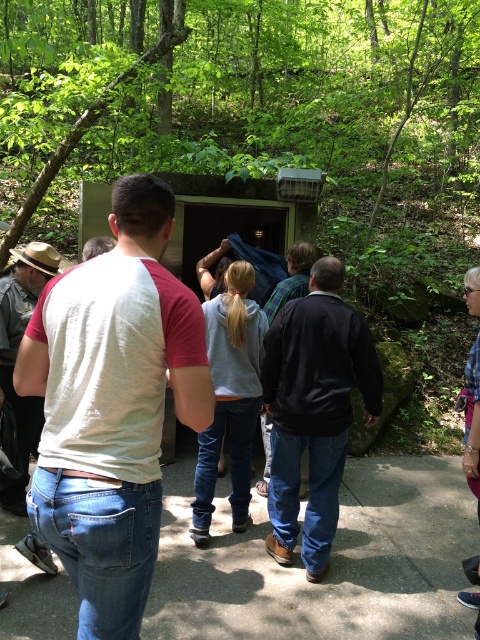
Question: Which of the following is the farthest from the observer?

Choices:
 (A) black leather jacket at center
 (B) white/red raglan shirt at center
 (C) dark blue flannel shirt at center
 (D) matte brown hat at left

Answer: (C)

Question: Can you confirm if white/red raglan shirt at center is thinner than black leather jacket at center?

Choices:
 (A) no
 (B) yes

Answer: (B)

Question: Can you confirm if green leafy forest at center is positioned to the left of black leather jacket at center?

Choices:
 (A) yes
 (B) no

Answer: (A)

Question: Can you confirm if black leather jacket at center is smaller than dark blue flannel shirt at center?

Choices:
 (A) yes
 (B) no

Answer: (B)

Question: Among these points, which one is nearest to the camera?

Choices:
 (A) (58, 214)
 (B) (35, 444)
 (C) (133, 536)
 (D) (360, 342)

Answer: (C)

Question: Which object is closer to the camera taking this photo?

Choices:
 (A) black leather jacket at center
 (B) white/red raglan shirt at center
 (C) matte brown hat at left
 (D) dark blue flannel shirt at center

Answer: (B)